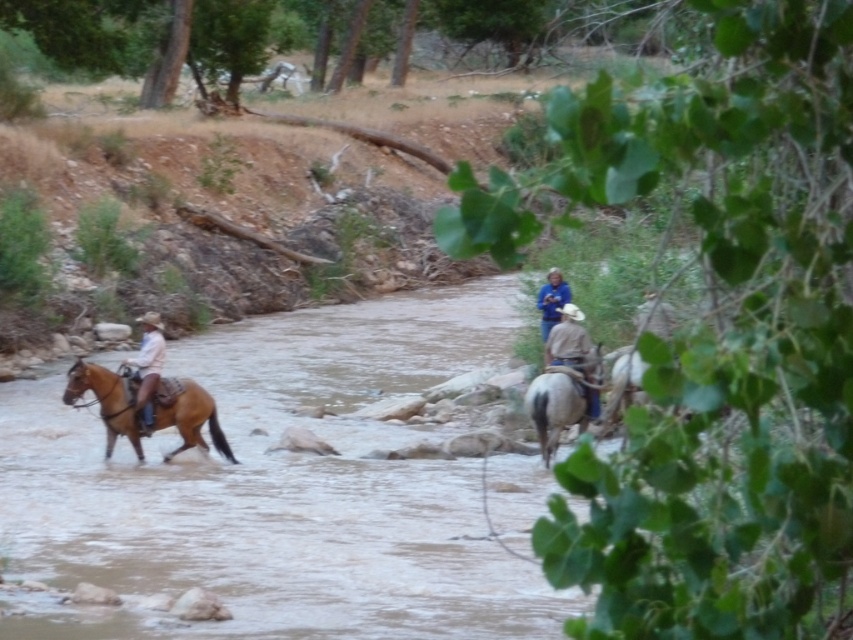
Question: Is the position of blue denim shirt at center more distant than that of blue denim jacket at center?

Choices:
 (A) no
 (B) yes

Answer: (A)

Question: Does brown glossy horse at left have a smaller size compared to blue denim jacket at center?

Choices:
 (A) no
 (B) yes

Answer: (A)

Question: Is blue denim shirt at center below light brown leather cowboy hat at left?

Choices:
 (A) yes
 (B) no

Answer: (A)

Question: Which point is farther to the camera?

Choices:
 (A) blue denim jacket at center
 (B) light brown leather cowboy hat at left

Answer: (A)

Question: Which point is farther from the camera taking this photo?

Choices:
 (A) (549, 285)
 (B) (531, 419)
 (C) (543, 294)
 (D) (132, 364)

Answer: (C)

Question: Which point is farther from the camera taking this photo?

Choices:
 (A) (152, 344)
 (B) (535, 413)

Answer: (A)